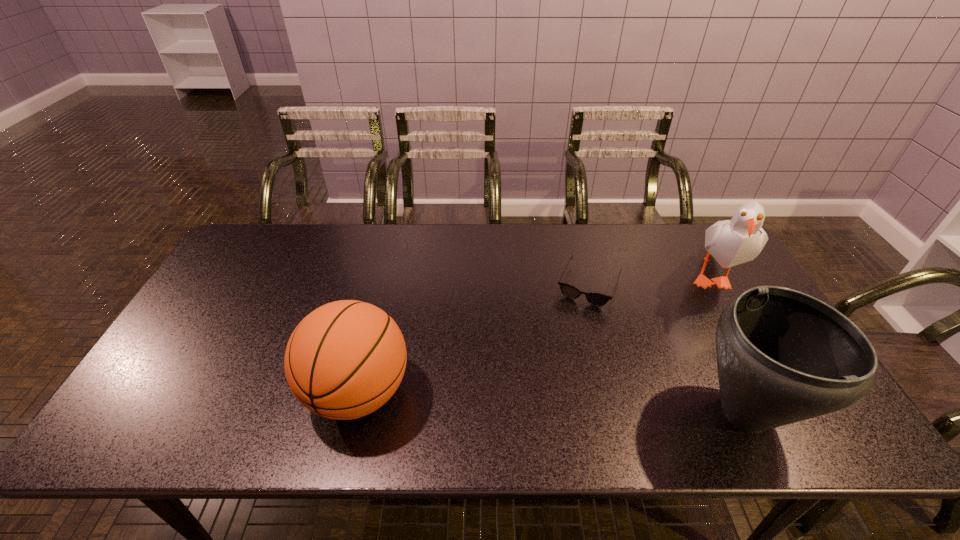
Locate an element on the screen. object located at the near right corner is located at coordinates (783, 356).

Where is `vacant space at the far edge of the desktop`? Image resolution: width=960 pixels, height=540 pixels. vacant space at the far edge of the desktop is located at coordinates (433, 243).

This screenshot has height=540, width=960. Find the location of `vacant space at the near edge`. vacant space at the near edge is located at coordinates (672, 405).

Identify the location of free location at the left edge. (212, 371).

You are a GUI agent. You are given a task and a screenshot of the screen. Output one action in this format:
    pyautogui.click(x=<x>, y=<y>)
    Task: Click on the vacant region at the right edge of the desktop
    
    Given the screenshot: What is the action you would take?
    pyautogui.click(x=712, y=291)

I want to click on vacant space at the far left corner, so 267,251.

Find the location of a particular element. The width and height of the screenshot is (960, 540). vacant region at the far right corner is located at coordinates (708, 268).

Identify the location of vacant area between the second object from left to right and the urn. (667, 348).

Image resolution: width=960 pixels, height=540 pixels. Find the location of `empty space that is in between the third object from right to left and the urn`. empty space that is in between the third object from right to left and the urn is located at coordinates (667, 348).

Find the location of `empty space between the shortest object and the leftmost object`. empty space between the shortest object and the leftmost object is located at coordinates (473, 339).